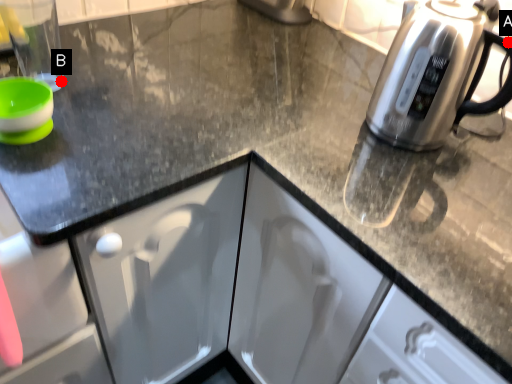
Question: Two points are circled on the image, labeled by A and B beside each circle. Which point appears farthest from the camera in this image?

Choices:
 (A) A is further
 (B) B is further

Answer: (A)